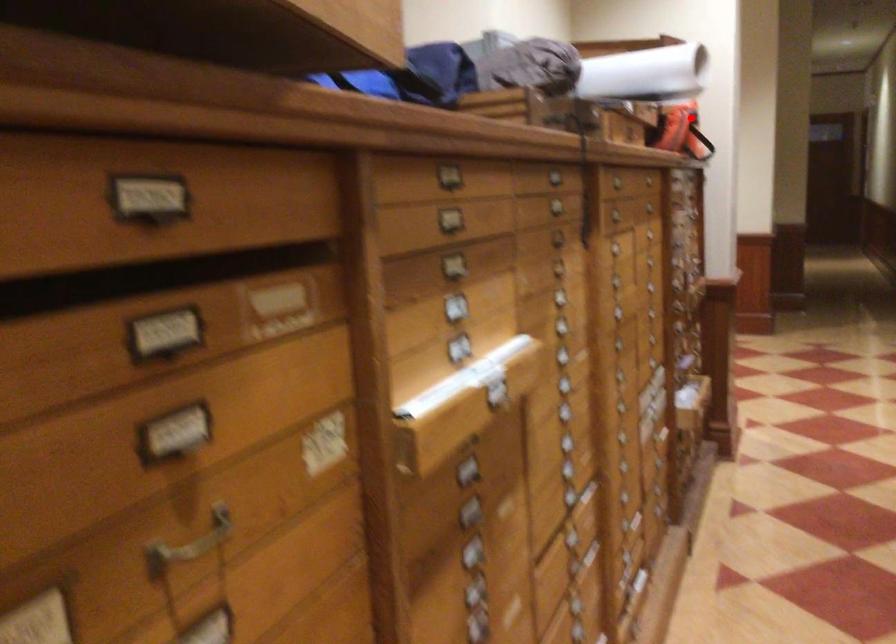
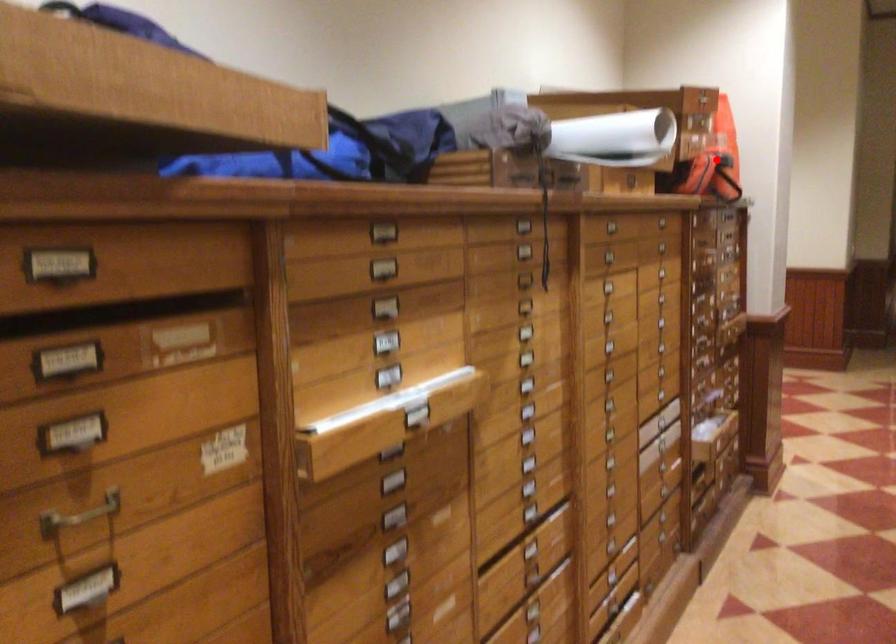
I am providing you with two images of the same scene from different viewpoints. A red point is marked on the first image and another point is marked on the second image. Is the marked point in image1 the same physical position as the marked point in image2?

Yes